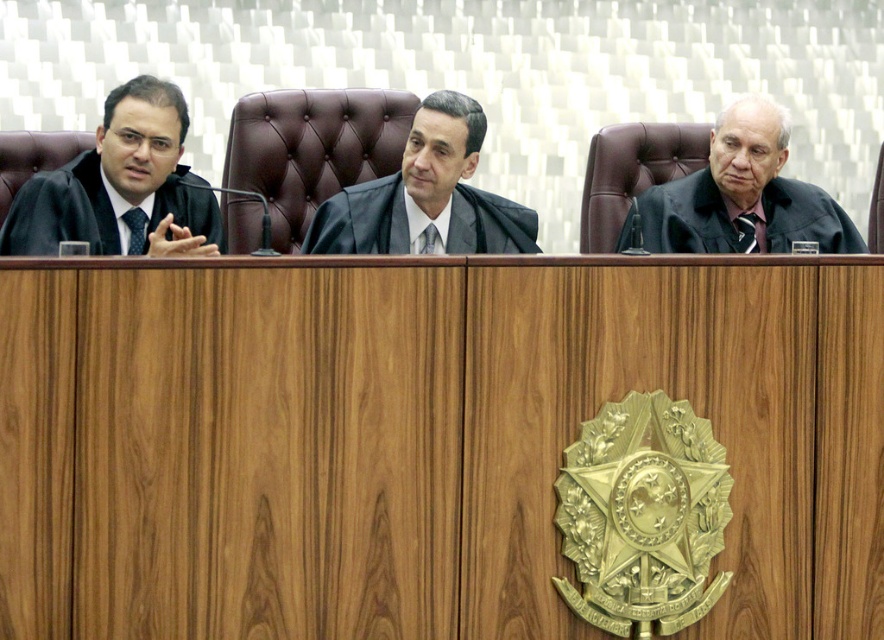
You are an assistant in the courtroom and need to hand a document to the judge. You see the matte black robe at left and the black matte judge at center. Which one is closer to you?

The black matte judge at center is closer to you because the matte black robe at left is much taller, indicating it is further away.

Looking at this image, you are an assistant in the courtroom and need to hand a document to the black matte judge at right and the black matte judge at center. Which judge should you approach first to reach them in the shortest path?

You should approach the black matte judge at right first because they are closer to you than the black matte judge at center, so the shortest path is to them.